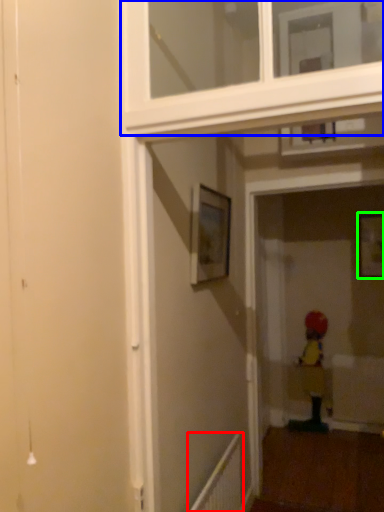
Question: Considering the real-world distances, which object is closest to radiator (highlighted by a red box)? window frame (highlighted by a blue box) or picture frame (highlighted by a green box).

Choices:
 (A) window frame
 (B) picture frame

Answer: (A)